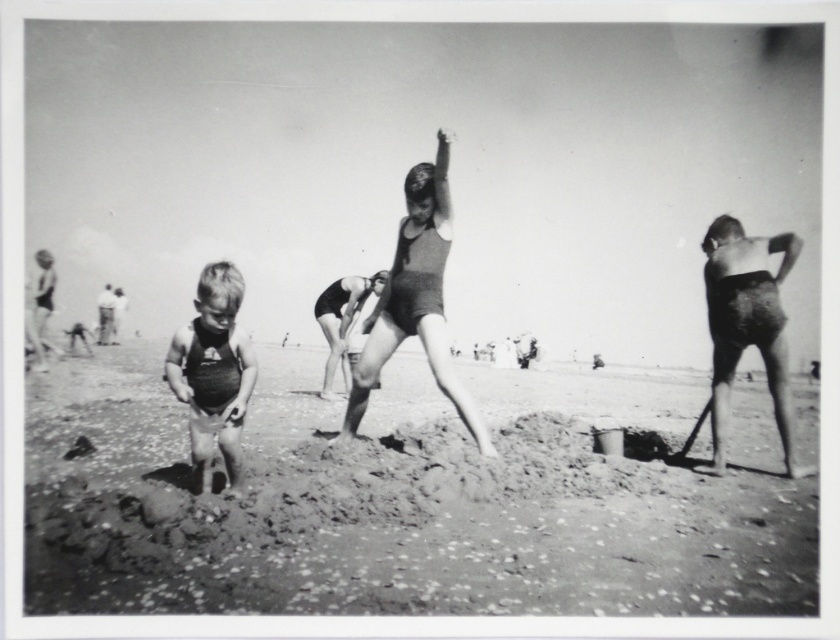
Question: Among these objects, which one is farthest from the camera?

Choices:
 (A) smooth sand at center
 (B) dark swimsuit at center

Answer: (B)

Question: Is dark swimsuit at center to the left of matte swimsuit at left from the viewer's perspective?

Choices:
 (A) yes
 (B) no

Answer: (B)

Question: Which of the following is the farthest from the observer?

Choices:
 (A) dark swimsuit at center
 (B) matte swimsuit at left

Answer: (A)

Question: Does dark swimsuit at center appear under matte swimsuit at left?

Choices:
 (A) no
 (B) yes

Answer: (A)

Question: Is smooth sand at center above dark swimsuit at center?

Choices:
 (A) no
 (B) yes

Answer: (A)

Question: Which of the following is the closest to the observer?

Choices:
 (A) dark swimsuit at center
 (B) matte swimsuit at left

Answer: (B)